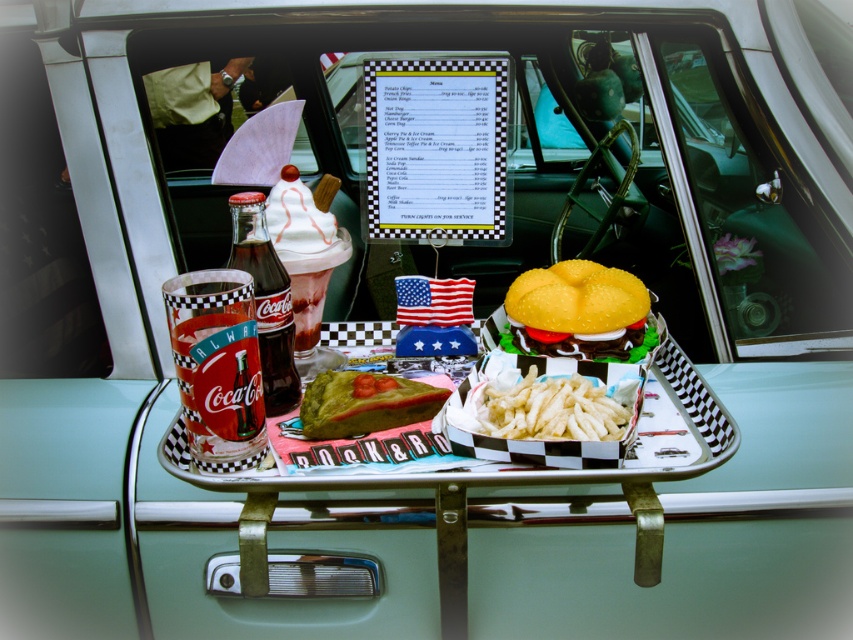
Question: Considering the real-world distances, which object is closest to the yellow sponge cake at center?

Choices:
 (A) white crispy fries at center
 (B) green matte cake at center
 (C) dark glass coca-cola bottle at center

Answer: (A)

Question: Which point is closer to the camera taking this photo?

Choices:
 (A) (291, 360)
 (B) (357, 419)
 (C) (525, 275)

Answer: (B)

Question: Is white crispy fries at center to the left of green matte cake at center from the viewer's perspective?

Choices:
 (A) no
 (B) yes

Answer: (A)

Question: Which object is the farthest from the green matte cake at center?

Choices:
 (A) dark glass coca-cola bottle at center
 (B) white crispy fries at center
 (C) yellow sponge cake at center

Answer: (C)

Question: Does yellow sponge cake at center lie in front of green matte cake at center?

Choices:
 (A) no
 (B) yes

Answer: (A)

Question: Is yellow sponge cake at center thinner than white crispy fries at center?

Choices:
 (A) yes
 (B) no

Answer: (B)